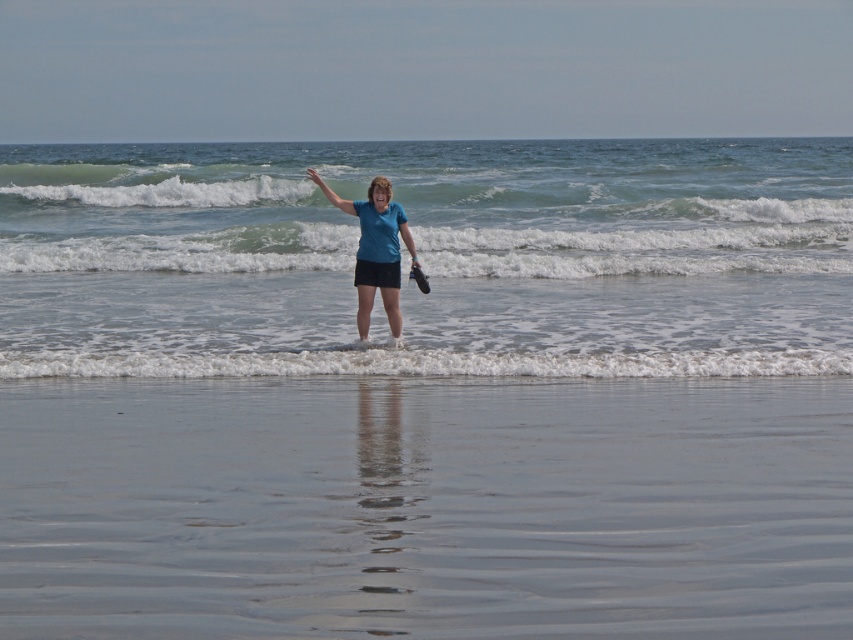
Does smooth sand at lower center lie behind smooth skin hand at center?

No, smooth sand at lower center is in front of smooth skin hand at center.

Can you confirm if smooth sand at lower center is thinner than smooth skin hand at center?

Yes, smooth sand at lower center is thinner than smooth skin hand at center.

The width and height of the screenshot is (853, 640). In order to click on smooth sand at lower center in this screenshot , I will do `click(426, 508)`.

The width and height of the screenshot is (853, 640). What are the coordinates of `smooth sand at lower center` in the screenshot? It's located at (426, 508).

Can you confirm if clear water at center is taller than blue fabric arm at center?

Correct, clear water at center is much taller as blue fabric arm at center.

Locate an element on the screen. Image resolution: width=853 pixels, height=640 pixels. clear water at center is located at coordinates (430, 259).

Who is positioned more to the right, blue matte shirt at center or matte black flip-flop at center?

From the viewer's perspective, matte black flip-flop at center appears more on the right side.

From the picture: Which is more to the left, blue matte shirt at center or matte black flip-flop at center?

Positioned to the left is blue matte shirt at center.

The width and height of the screenshot is (853, 640). Identify the location of blue matte shirt at center. (376, 250).